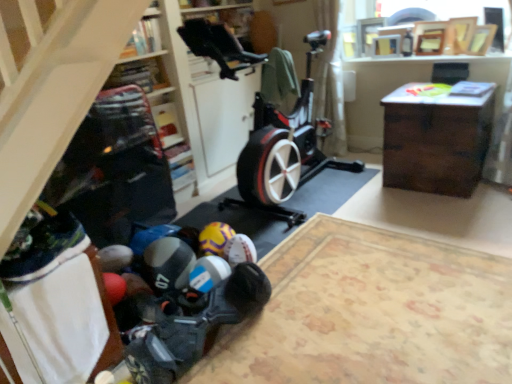
In order to click on free space to the left of dark wood desk at right in this screenshot , I will do `click(357, 192)`.